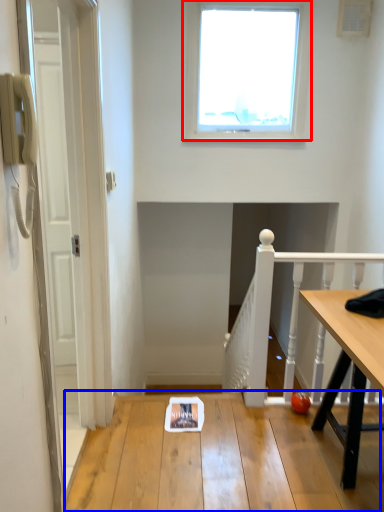
Question: Which point is further to the camera, window (highlighted by a red box) or table (highlighted by a blue box)?

Choices:
 (A) window
 (B) table

Answer: (A)